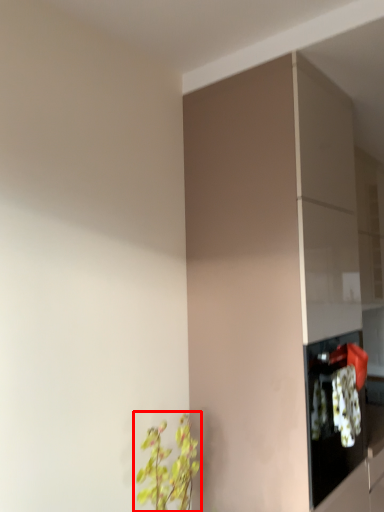
Question: From the image's perspective, where is houseplant (annotated by the red box) located relative to cabinetry?

Choices:
 (A) below
 (B) above

Answer: (A)